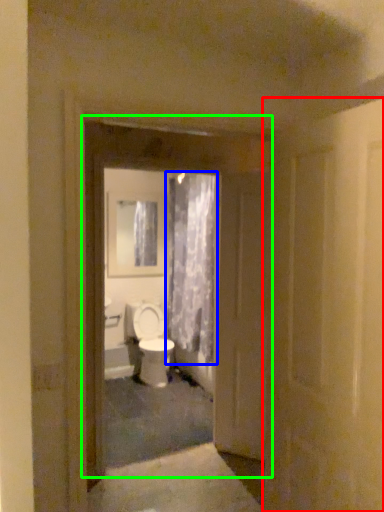
Question: Which is nearer to the door (highlighted by a red box)? curtain (highlighted by a blue box) or door (highlighted by a green box).

Choices:
 (A) curtain
 (B) door

Answer: (B)